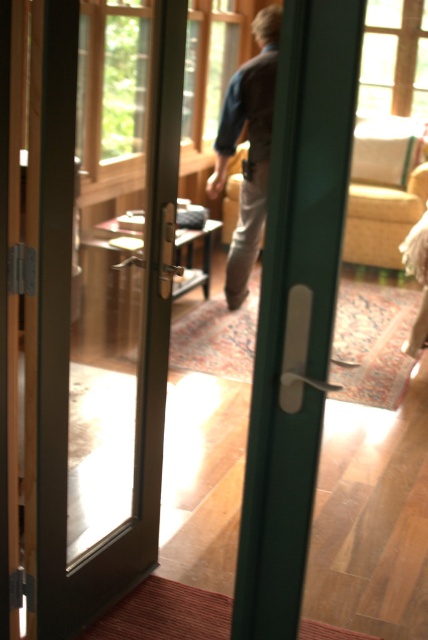
The width and height of the screenshot is (428, 640). What do you see at coordinates (104, 296) in the screenshot?
I see `matte glass door at center` at bounding box center [104, 296].

The height and width of the screenshot is (640, 428). In order to click on matte glass door at center in this screenshot , I will do `click(104, 296)`.

This screenshot has height=640, width=428. What are the coordinates of `matte glass door at center` in the screenshot? It's located at (104, 296).